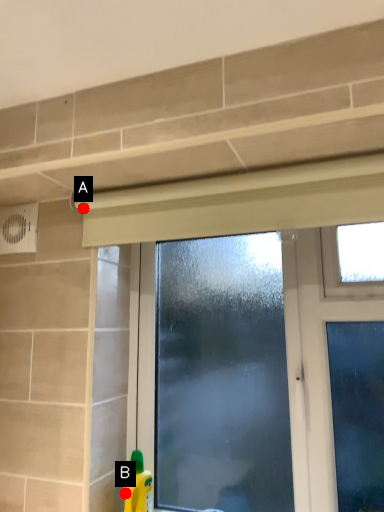
Question: Two points are circled on the image, labeled by A and B beside each circle. Which point is closer to the camera taking this photo?

Choices:
 (A) A is closer
 (B) B is closer

Answer: (B)